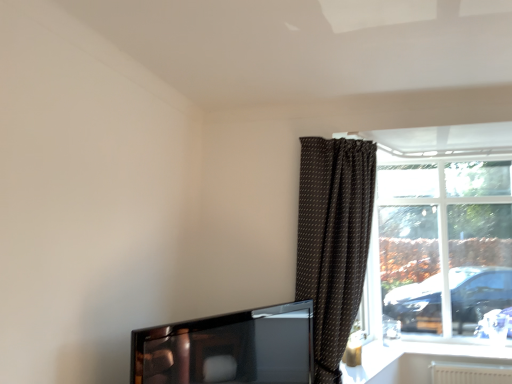
Question: From a real-world perspective, is brown dotted fabric curtain at right positioned above or below white glossy window sill at lower right?

Choices:
 (A) above
 (B) below

Answer: (A)

Question: In the image, is brown dotted fabric curtain at right positioned in front of or behind white glossy window sill at lower right?

Choices:
 (A) front
 (B) behind

Answer: (A)

Question: Estimate the real-world distances between objects in this image. Which object is farther from the brown dotted fabric curtain at right?

Choices:
 (A) transparent glass window at right
 (B) shiny black tv at lower left
 (C) white glossy window sill at lower right

Answer: (C)

Question: Which of these objects is positioned farthest from the white glossy window sill at lower right?

Choices:
 (A) brown dotted fabric curtain at right
 (B) shiny black tv at lower left
 (C) transparent glass window at right

Answer: (B)